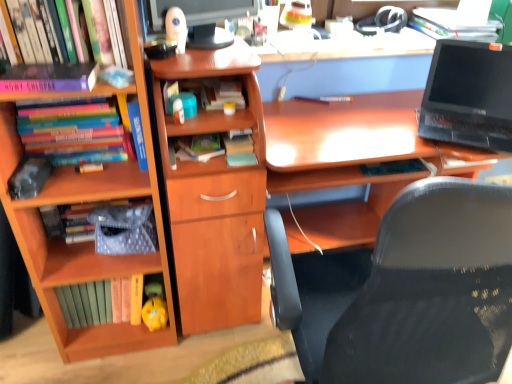
Question: Can you confirm if yellow matte piggy bank at lower center is smaller than matte black laptop at upper right, the first book when ordered from right to left?

Choices:
 (A) no
 (B) yes

Answer: (B)

Question: Does yellow matte piggy bank at lower center turn towards matte black laptop at upper right, placed as the sixth book when sorted from left to right?

Choices:
 (A) yes
 (B) no

Answer: (B)

Question: Is yellow matte piggy bank at lower center not near matte black laptop at upper right, placed as the sixth book when sorted from left to right?

Choices:
 (A) no
 (B) yes

Answer: (B)

Question: From the image's perspective, does yellow matte piggy bank at lower center appear lower than matte black laptop at upper right, the first book when ordered from right to left?

Choices:
 (A) yes
 (B) no

Answer: (A)

Question: Is yellow matte piggy bank at lower center at the left side of matte black laptop at upper right, the first book when ordered from right to left?

Choices:
 (A) no
 (B) yes

Answer: (B)

Question: In terms of width, does yellow matte piggy bank at lower center look wider or thinner when compared to wooden bookcase at left?

Choices:
 (A) wide
 (B) thin

Answer: (B)

Question: From their relative heights in the image, would you say yellow matte piggy bank at lower center is taller or shorter than wooden bookcase at left?

Choices:
 (A) short
 (B) tall

Answer: (A)

Question: In terms of size, does yellow matte piggy bank at lower center appear bigger or smaller than wooden bookcase at left?

Choices:
 (A) big
 (B) small

Answer: (B)

Question: Relative to wooden bookcase at left, is yellow matte piggy bank at lower center in front or behind?

Choices:
 (A) front
 (B) behind

Answer: (B)

Question: Visually, is matte black laptop at upper right, placed as the sixth book when sorted from left to right, positioned to the left or to the right of blue matte book at upper left?

Choices:
 (A) left
 (B) right

Answer: (B)

Question: From the image's perspective, is matte black laptop at upper right, the first book when ordered from right to left, above or below blue matte book at upper left?

Choices:
 (A) above
 (B) below

Answer: (A)

Question: Is matte black laptop at upper right, the first book when ordered from right to left, in front of or behind blue matte book at upper left in the image?

Choices:
 (A) front
 (B) behind

Answer: (B)

Question: In terms of width, does matte black laptop at upper right, placed as the sixth book when sorted from left to right, look wider or thinner when compared to blue matte book at upper left?

Choices:
 (A) thin
 (B) wide

Answer: (B)

Question: In terms of size, does hardcover book at center, the 5th book in the left-to-right sequence, appear bigger or smaller than hardcover books at left, which ranks as the second book in left-to-right order?

Choices:
 (A) small
 (B) big

Answer: (A)

Question: In terms of width, does hardcover book at center, the 2th book when ordered from right to left, look wider or thinner when compared to hardcover books at left, placed as the 5th book when sorted from right to left?

Choices:
 (A) wide
 (B) thin

Answer: (B)